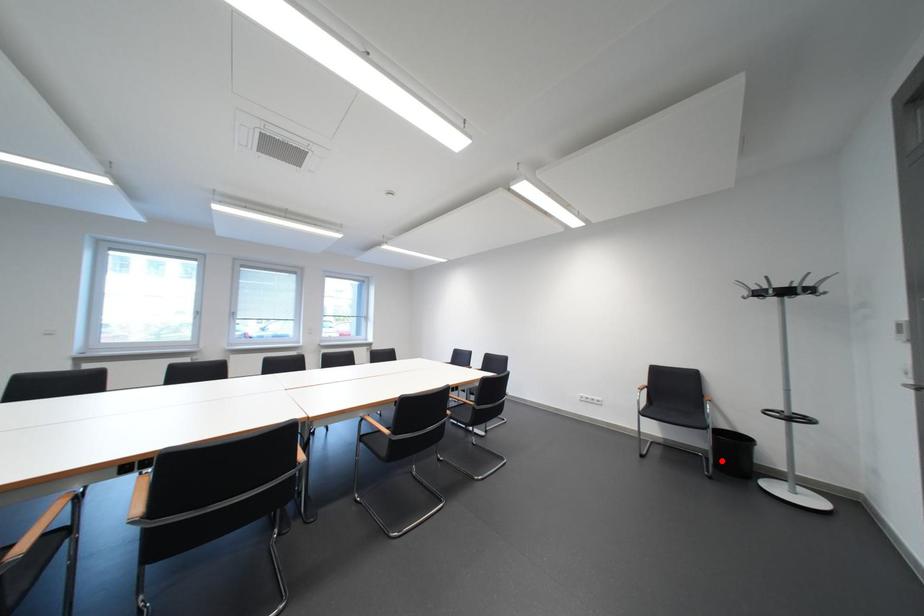
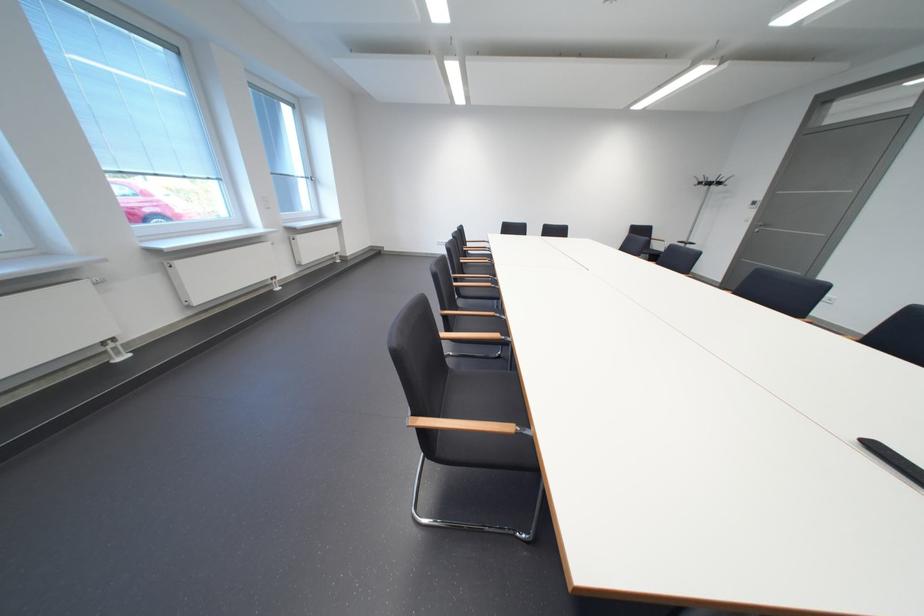
Question: I am providing you with two images of the same scene from different viewpoints. A red point is marked on the first image. Can you still see the location of the red point in image 2?

Choices:
 (A) Yes
 (B) No

Answer: (B)